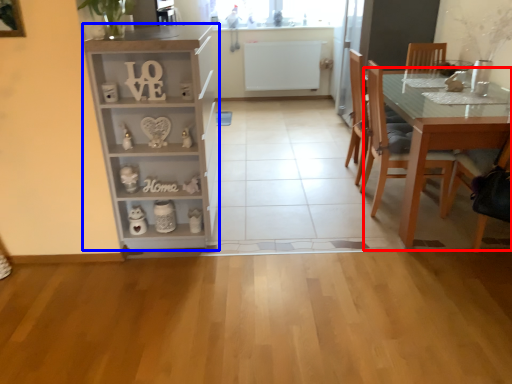
Question: Which object appears farthest to the camera in this image, table (highlighted by a red box) or cabinetry (highlighted by a blue box)?

Choices:
 (A) table
 (B) cabinetry

Answer: (A)